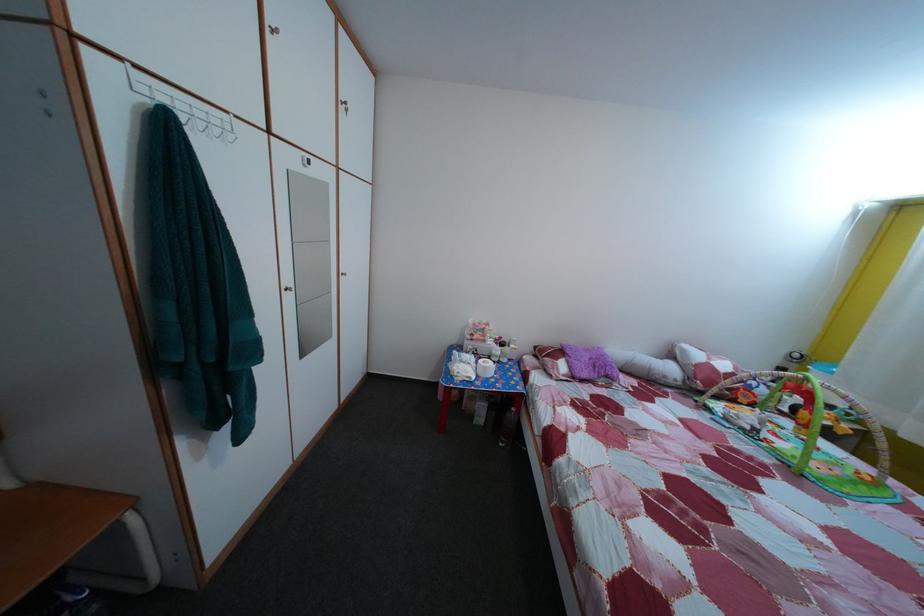
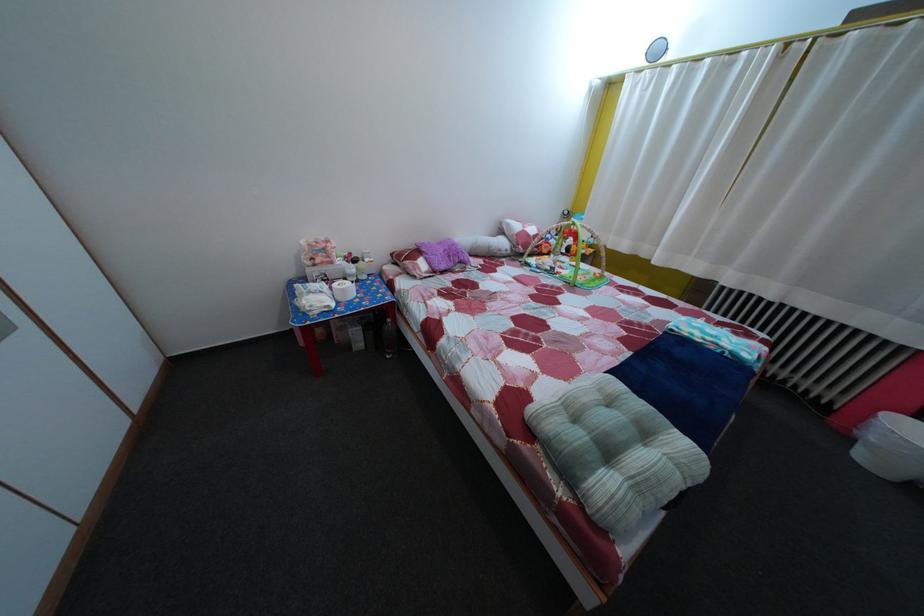
Find the pixel in the second image that matches point 597,358 in the first image.

(450, 252)